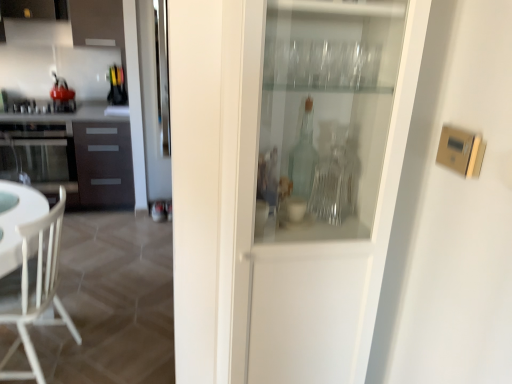
Question: Is metallic silver stove at left, the first appliance in the bottom-to-top sequence, smaller than shiny red kettle at left, positioned as the 2th appliance in bottom-to-top order?

Choices:
 (A) yes
 (B) no

Answer: (B)

Question: From a real-world perspective, is metallic silver stove at left, the first appliance in the bottom-to-top sequence, below shiny red kettle at left, which ranks as the first appliance in top-to-bottom order?

Choices:
 (A) yes
 (B) no

Answer: (A)

Question: From the image's perspective, is metallic silver stove at left, the first appliance in the bottom-to-top sequence, under shiny red kettle at left, positioned as the 2th appliance in bottom-to-top order?

Choices:
 (A) no
 (B) yes

Answer: (B)

Question: Is metallic silver stove at left, marked as the 2th appliance in a top-to-bottom arrangement, completely or partially outside of shiny red kettle at left, which ranks as the first appliance in top-to-bottom order?

Choices:
 (A) no
 (B) yes

Answer: (B)

Question: Considering the relative sizes of metallic silver stove at left, marked as the 2th appliance in a top-to-bottom arrangement, and shiny red kettle at left, positioned as the 2th appliance in bottom-to-top order, in the image provided, is metallic silver stove at left, marked as the 2th appliance in a top-to-bottom arrangement, thinner than shiny red kettle at left, positioned as the 2th appliance in bottom-to-top order,?

Choices:
 (A) yes
 (B) no

Answer: (B)

Question: Looking at the image, does shiny red kettle at left, which ranks as the first appliance in top-to-bottom order, seem bigger or smaller compared to satin black oven at left?

Choices:
 (A) big
 (B) small

Answer: (B)

Question: Is shiny red kettle at left, which ranks as the first appliance in top-to-bottom order, to the left or to the right of satin black oven at left in the image?

Choices:
 (A) right
 (B) left

Answer: (A)

Question: Considering the positions of point (62, 107) and point (2, 132), is point (62, 107) closer or farther from the camera than point (2, 132)?

Choices:
 (A) closer
 (B) farther

Answer: (B)

Question: Is shiny red kettle at left, positioned as the 2th appliance in bottom-to-top order, taller or shorter than satin black oven at left?

Choices:
 (A) short
 (B) tall

Answer: (A)

Question: Looking at their shapes, would you say shiny red kettle at left, which ranks as the first appliance in top-to-bottom order, is wider or thinner than white wood chair at lower left?

Choices:
 (A) thin
 (B) wide

Answer: (A)

Question: From the image's perspective, is shiny red kettle at left, positioned as the 2th appliance in bottom-to-top order, positioned above or below white wood chair at lower left?

Choices:
 (A) above
 (B) below

Answer: (A)

Question: In terms of height, does shiny red kettle at left, which ranks as the first appliance in top-to-bottom order, look taller or shorter compared to white wood chair at lower left?

Choices:
 (A) short
 (B) tall

Answer: (A)

Question: Do you think shiny red kettle at left, positioned as the 2th appliance in bottom-to-top order, is within white wood chair at lower left, or outside of it?

Choices:
 (A) outside
 (B) inside

Answer: (A)

Question: From the image's perspective, is transparent glass cabinet at center located above or below dark brown wood cabinet at left?

Choices:
 (A) above
 (B) below

Answer: (B)

Question: Considering the positions of transparent glass cabinet at center and dark brown wood cabinet at left in the image, is transparent glass cabinet at center taller or shorter than dark brown wood cabinet at left?

Choices:
 (A) short
 (B) tall

Answer: (B)